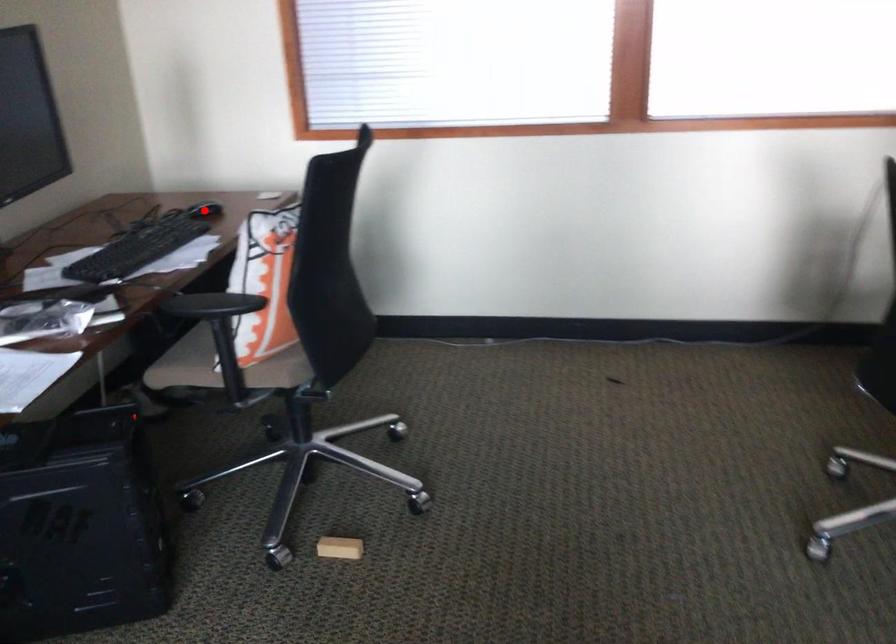
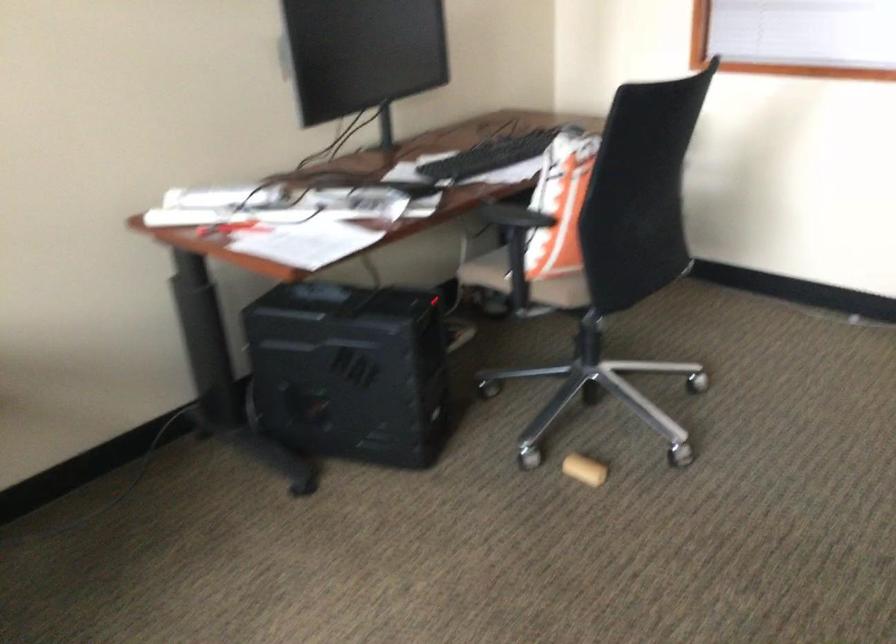
Question: I am providing you with two images of the same scene from different viewpoints. A red point is marked on the first image. At the location where the point appears in image 1, is it still visible in image 2?

Choices:
 (A) Yes
 (B) No

Answer: (B)